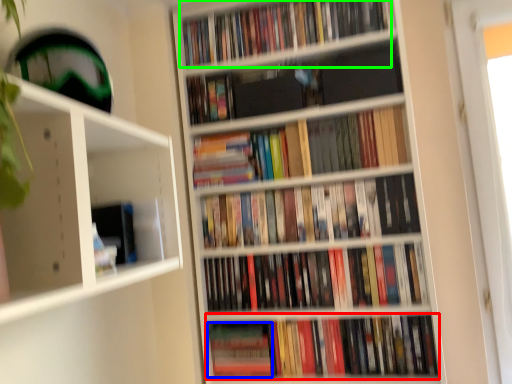
Question: Which is farther away from book (highlighted by a red box)? paperback book (highlighted by a blue box) or book (highlighted by a green box)?

Choices:
 (A) paperback book
 (B) book

Answer: (B)